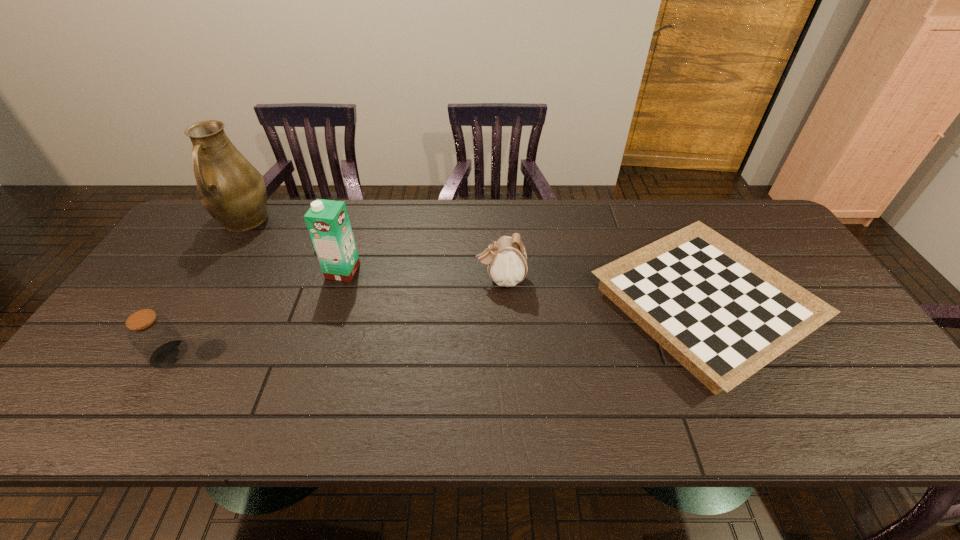
At what (x,y) coordinates should I click in order to perform the action: click on object present at the far left corner. Please return your answer as a coordinate pair (x, y). Looking at the image, I should click on (229, 187).

Identify the location of object that is positioned at the far right corner. (722, 313).

Locate an element on the screen. Image resolution: width=960 pixels, height=540 pixels. object that is positioned at the near right corner is located at coordinates (722, 313).

You are a GUI agent. You are given a task and a screenshot of the screen. Output one action in this format:
    pyautogui.click(x=<x>, y=<y>)
    Task: Click on the free region at the far edge
    This screenshot has width=960, height=540.
    Given the screenshot: What is the action you would take?
    pyautogui.click(x=525, y=236)

This screenshot has height=540, width=960. In the image, there is a desktop. In order to click on free region at the near edge in this screenshot , I will do `click(510, 427)`.

Locate an element on the screen. vacant region at the left edge of the desktop is located at coordinates (152, 305).

Where is `free space at the right edge of the desktop`? The image size is (960, 540). free space at the right edge of the desktop is located at coordinates (828, 374).

Find the location of `free space at the far right corner of the desktop`. free space at the far right corner of the desktop is located at coordinates (773, 232).

Image resolution: width=960 pixels, height=540 pixels. Identify the location of empty space between the pitcher and the checkerboard. (473, 263).

Where is `free space between the third object from right to left and the pouch`? The height and width of the screenshot is (540, 960). free space between the third object from right to left and the pouch is located at coordinates (421, 275).